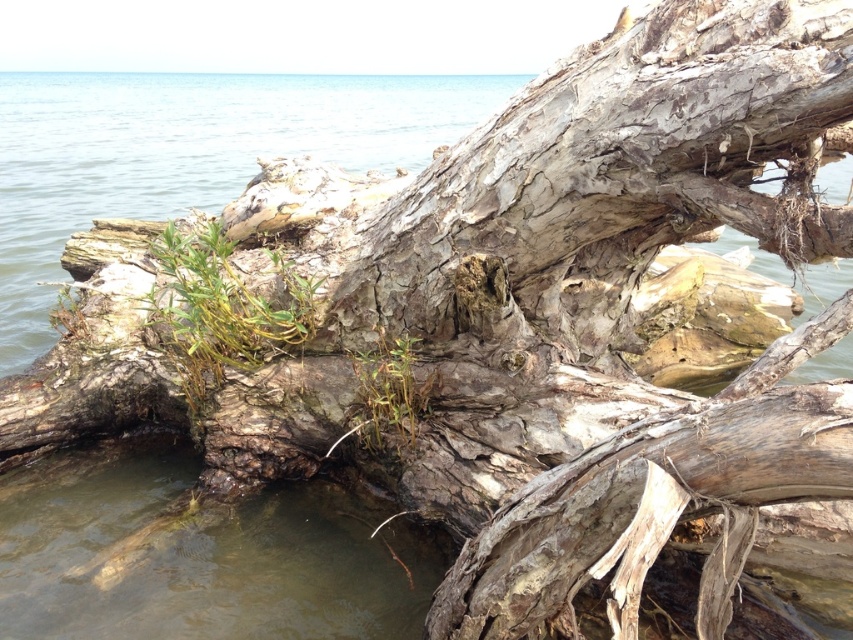
Question: Which is nearer to the green grassy plant at center?

Choices:
 (A) green grassy weed at center
 (B) clear water at lower left

Answer: (A)

Question: Can you confirm if green grassy plant at center is bigger than green grassy weed at center?

Choices:
 (A) yes
 (B) no

Answer: (A)

Question: Which point is farther from the camera taking this photo?

Choices:
 (A) (399, 412)
 (B) (190, 352)
 (C) (33, 228)

Answer: (C)

Question: Is green grassy plant at center smaller than green grassy weed at center?

Choices:
 (A) yes
 (B) no

Answer: (B)

Question: Which is farther from the clear water at lower left?

Choices:
 (A) green grassy plant at center
 (B) green grassy weed at center

Answer: (B)

Question: Can you confirm if clear water at lower left is wider than green grassy weed at center?

Choices:
 (A) no
 (B) yes

Answer: (B)